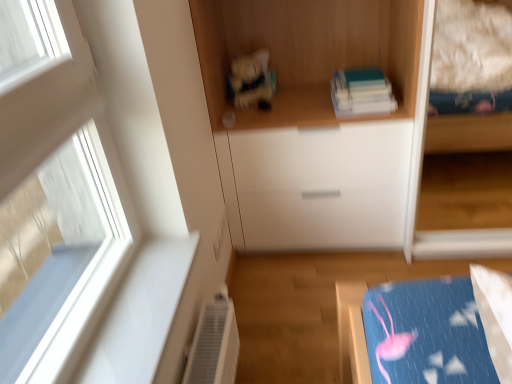
Question: Is wooden books at upper center taller than matte plastic toy at center?

Choices:
 (A) no
 (B) yes

Answer: (B)

Question: Is the surface of wooden books at upper center in direct contact with matte plastic toy at center?

Choices:
 (A) no
 (B) yes

Answer: (A)

Question: Does wooden books at upper center appear on the left side of matte plastic toy at center?

Choices:
 (A) yes
 (B) no

Answer: (B)

Question: Is wooden books at upper center not inside matte plastic toy at center?

Choices:
 (A) yes
 (B) no

Answer: (A)

Question: From the image's perspective, is wooden books at upper center located beneath matte plastic toy at center?

Choices:
 (A) no
 (B) yes

Answer: (A)

Question: In terms of size, does wooden books at upper center appear bigger or smaller than white glossy drawer at center?

Choices:
 (A) big
 (B) small

Answer: (B)

Question: From a real-world perspective, relative to white glossy drawer at center, is wooden books at upper center vertically above or below?

Choices:
 (A) below
 (B) above

Answer: (B)

Question: Is wooden books at upper center to the left or to the right of white glossy drawer at center in the image?

Choices:
 (A) right
 (B) left

Answer: (B)

Question: From their relative heights in the image, would you say wooden books at upper center is taller or shorter than white glossy drawer at center?

Choices:
 (A) short
 (B) tall

Answer: (A)

Question: From the image's perspective, relative to wooden books at upper center, is matte plastic toy at center above or below?

Choices:
 (A) above
 (B) below

Answer: (B)

Question: Looking at their shapes, would you say matte plastic toy at center is wider or thinner than wooden books at upper center?

Choices:
 (A) thin
 (B) wide

Answer: (A)

Question: From a real-world perspective, is matte plastic toy at center above or below wooden books at upper center?

Choices:
 (A) below
 (B) above

Answer: (A)

Question: Is matte plastic toy at center bigger or smaller than wooden books at upper center?

Choices:
 (A) small
 (B) big

Answer: (A)

Question: From the image's perspective, is matte plastic toy at center above or below white glossy drawer at center?

Choices:
 (A) below
 (B) above

Answer: (B)

Question: Would you say matte plastic toy at center is inside or outside white glossy drawer at center?

Choices:
 (A) outside
 (B) inside

Answer: (A)